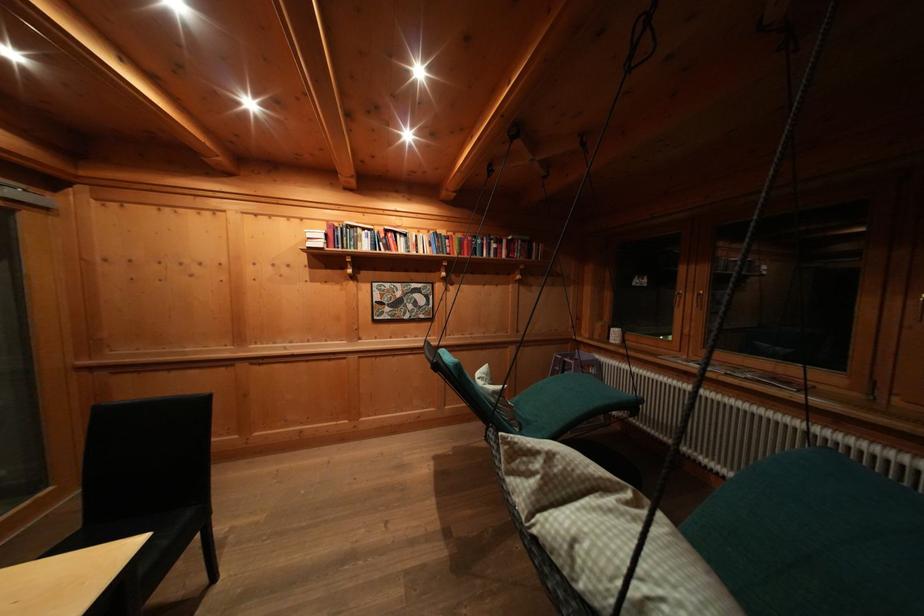
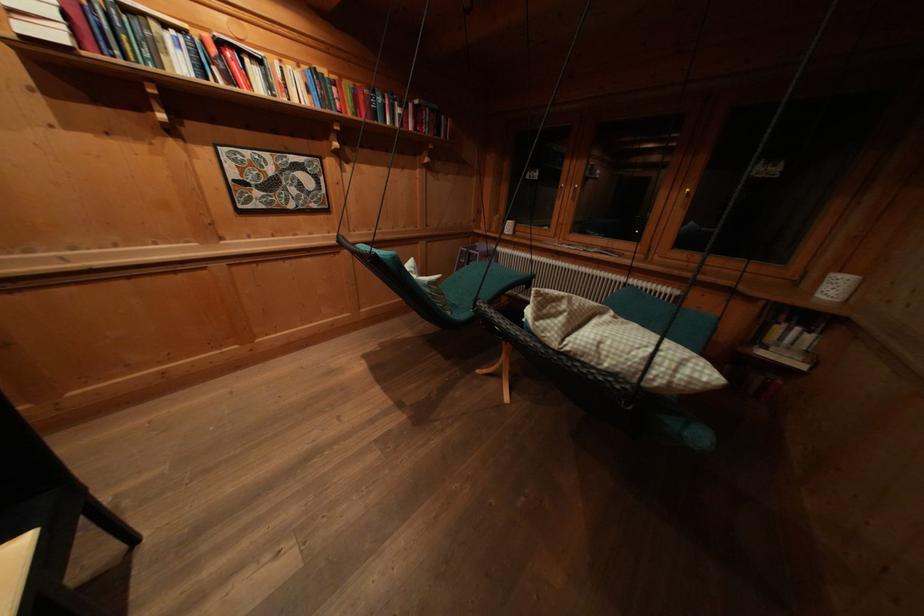
Where in the second image is the point corresponding to [540,487] from the first image?

(567, 323)